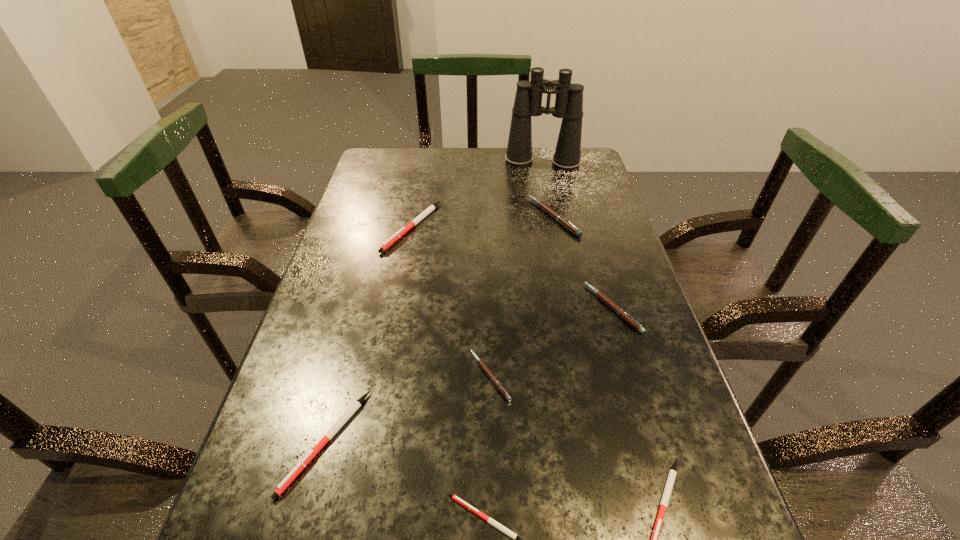
Find the location of `the tallest object`. the tallest object is located at coordinates (569, 97).

At what (x,y) coordinates should I click in order to perform the action: click on the farthest object. Please return your answer as a coordinate pair (x, y). Looking at the image, I should click on (569, 97).

The height and width of the screenshot is (540, 960). I want to click on the farthest pink pen, so click(x=563, y=221).

You are a GUI agent. You are given a task and a screenshot of the screen. Output one action in this format:
    pyautogui.click(x=<x>, y=<y>)
    Task: Click on the biggest white pen
    
    Given the screenshot: What is the action you would take?
    pyautogui.click(x=403, y=230)

This screenshot has width=960, height=540. Find the location of `the third farthest pen`. the third farthest pen is located at coordinates (624, 315).

You are a GUI agent. You are given a task and a screenshot of the screen. Output one action in this format:
    pyautogui.click(x=<x>, y=<y>)
    Task: Click on the fifth nearest object
    Image resolution: width=960 pixels, height=540 pixels.
    Given the screenshot: What is the action you would take?
    pyautogui.click(x=624, y=315)

Identify the location of the third smallest white pen. This screenshot has width=960, height=540. (345, 417).

Image resolution: width=960 pixels, height=540 pixels. In order to click on the nearest pink pen in this screenshot , I will do `click(494, 380)`.

Where is `the smallest pink pen`? The width and height of the screenshot is (960, 540). the smallest pink pen is located at coordinates (494, 380).

Locate an element on the screen. Image resolution: width=960 pixels, height=540 pixels. vacant space located on the left of the binoculars is located at coordinates (444, 162).